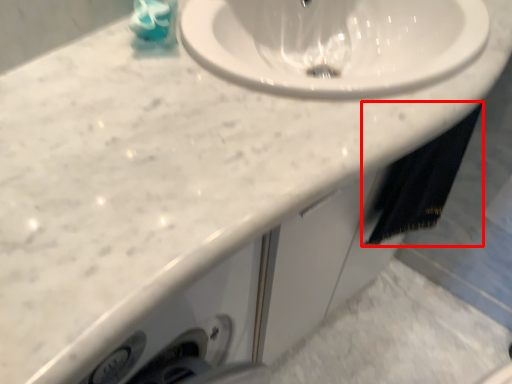
Question: From the image's perspective, where is bath towel (annotated by the red box) located in relation to liquid in the image?

Choices:
 (A) below
 (B) above

Answer: (A)